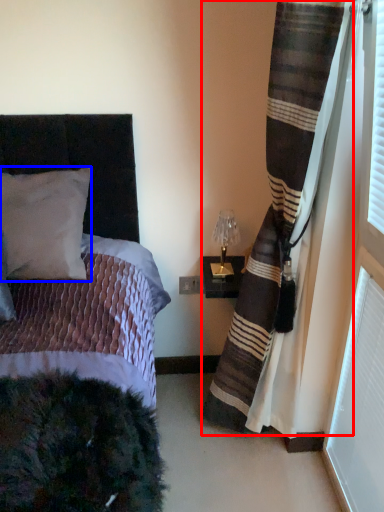
Question: Which object appears farthest to the camera in this image, curtain (highlighted by a red box) or pillow (highlighted by a blue box)?

Choices:
 (A) curtain
 (B) pillow

Answer: (B)